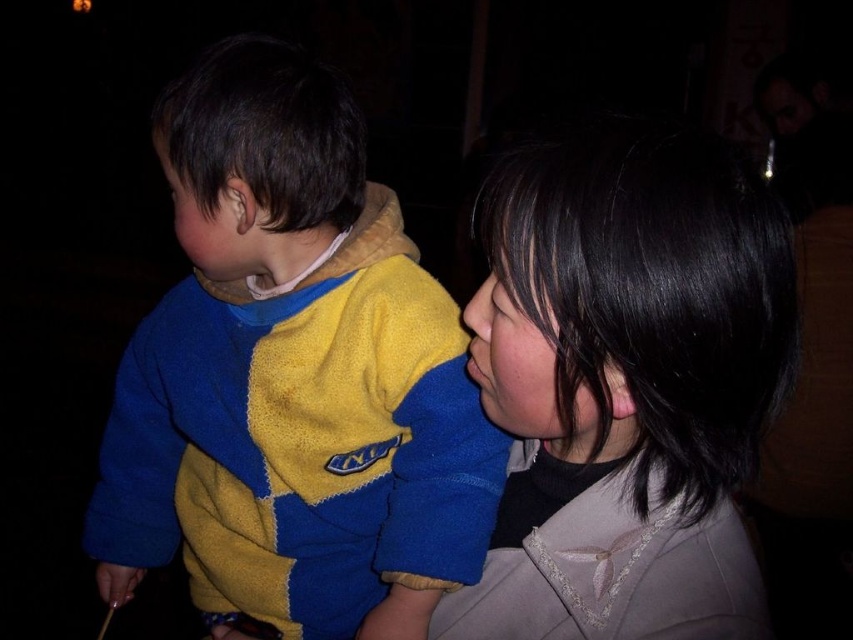
You are holding a 70 centimeter long ruler and want to measure the distance from your eyes to the point at coordinates point (291, 192). Can you reach the point with the ruler?

Answer: The distance of point (291, 192) from viewer is 75.80 centimeters. Since the ruler is 70 centimeters long, it is shorter than the required distance. You cannot reach the point with the ruler.

Based on the scene description, where is the yellow fleece sweater located in relation to the point marked at coordinates (292, 376)?

The point at coordinates (292, 376) corresponds to the yellow fleece sweater at left.

You are a photographer trying to capture a clear shot of both the yellow fleece sweater at left and the smooth black hair at upper right. Which object should you focus on first to ensure it appears sharp in the photo?

You should focus on the yellow fleece sweater at left first because it is closer to you than the smooth black hair at upper right, so focusing on the closer object ensures it will be sharp.